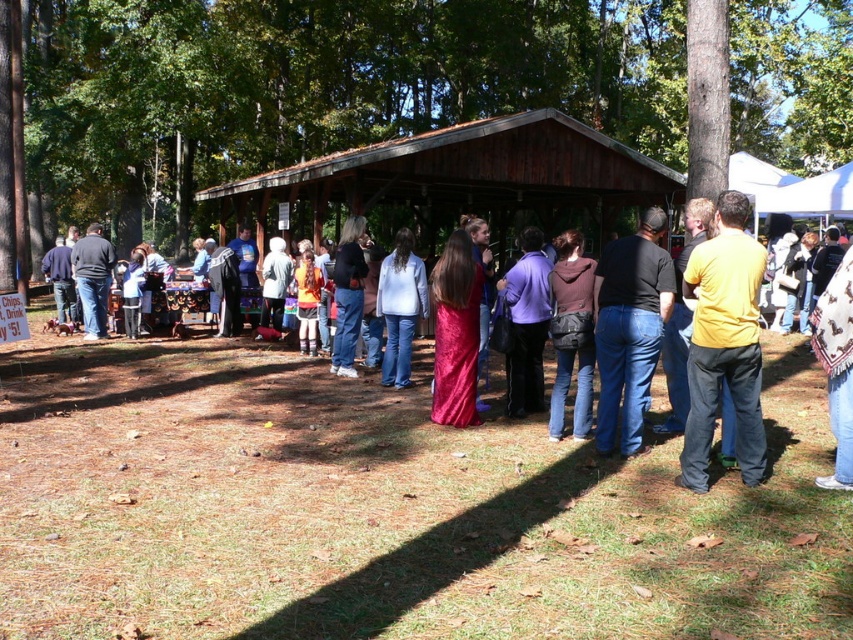
Is point (570, 273) farther from camera compared to point (91, 246)?

No, (570, 273) is closer to viewer.

Is point (567, 298) less distant than point (86, 288)?

That is True.

Which is in front, point (589, 316) or point (84, 250)?

Point (589, 316)

Image resolution: width=853 pixels, height=640 pixels. Find the location of `dark brown leather jacket at center`. dark brown leather jacket at center is located at coordinates (572, 333).

Does black matte shirt at center appear under purple fabric dress at center?

Indeed, black matte shirt at center is positioned under purple fabric dress at center.

Is black matte shirt at center to the right of purple fabric dress at center from the viewer's perspective?

Yes, black matte shirt at center is to the right of purple fabric dress at center.

Identify the location of black matte shirt at center. Image resolution: width=853 pixels, height=640 pixels. (630, 328).

Does purple fabric dress at center have a lesser width compared to matte black shirt at left?

Indeed, purple fabric dress at center has a lesser width compared to matte black shirt at left.

Find the location of `purple fabric dress at center`. purple fabric dress at center is located at coordinates (526, 323).

You are a GUI agent. You are given a task and a screenshot of the screen. Output one action in this format:
    pyautogui.click(x=<x>, y=<y>)
    Task: Click on the purple fabric dress at center
    This screenshot has height=640, width=853.
    Given the screenshot: What is the action you would take?
    pyautogui.click(x=526, y=323)